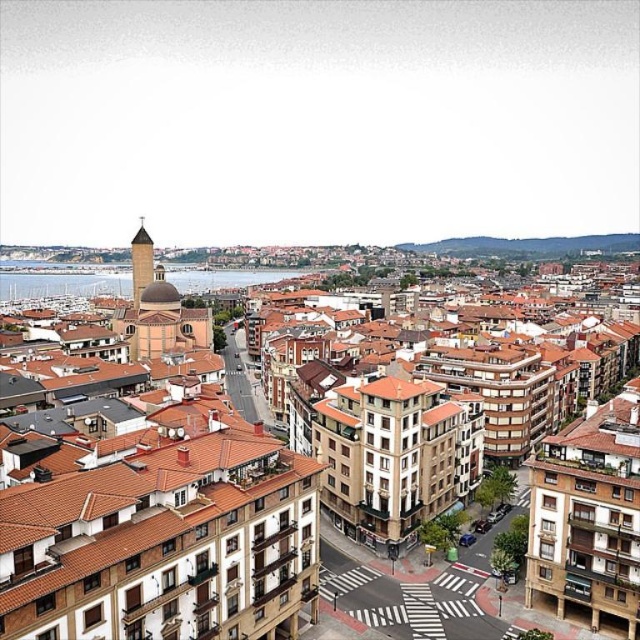
Does brown brick building at center have a greater height compared to blue water at center?

Yes.

Describe the element at coordinates (161, 532) in the screenshot. This screenshot has height=640, width=640. I see `brown brick building at center` at that location.

Is point (147, 285) farther from viewer compared to point (10, 284)?

That is False.

The width and height of the screenshot is (640, 640). I want to click on brown brick building at center, so click(x=161, y=532).

Does blue water at center appear on the left side of smooth stone bell tower at upper center?

Correct, you'll find blue water at center to the left of smooth stone bell tower at upper center.

Which is above, blue water at center or smooth stone bell tower at upper center?

smooth stone bell tower at upper center is above.

Who is more forward, (54, 280) or (147, 257)?

Point (147, 257)

The width and height of the screenshot is (640, 640). In order to click on blue water at center in this screenshot , I will do `click(61, 284)`.

Is brown brick building at center to the right of smooth stone bell tower at upper center from the viewer's perspective?

Yes, brown brick building at center is to the right of smooth stone bell tower at upper center.

Find the location of a particular element. This screenshot has height=640, width=640. brown brick building at center is located at coordinates tap(161, 532).